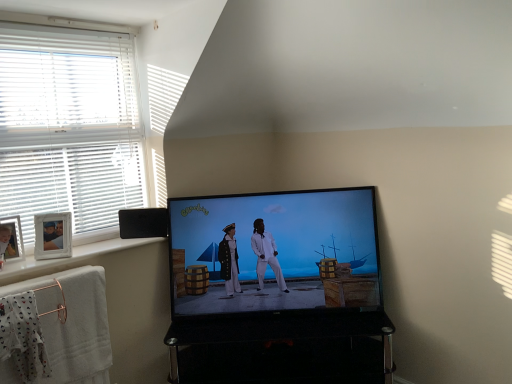
Locate an element on the screen. The height and width of the screenshot is (384, 512). white cotton cloth at lower left is located at coordinates (23, 336).

I want to click on shiny black screen at center, so click(x=274, y=252).

The image size is (512, 384). Describe the element at coordinates (14, 239) in the screenshot. I see `wooden photo frame at left` at that location.

Identify the location of white cotton cloth at lower left. (23, 336).

Which object is closer to the camera taking this photo, white cotton bath towel at lower left or shiny black screen at center?

white cotton bath towel at lower left.

Measure the distance between white cotton bath towel at lower left and shiny black screen at center.

74.74 centimeters.

From a real-world perspective, is white cotton bath towel at lower left beneath shiny black screen at center?

Indeed, from a real-world perspective, white cotton bath towel at lower left is positioned beneath shiny black screen at center.

Is white cotton bath towel at lower left not near shiny black screen at center?

Actually, white cotton bath towel at lower left and shiny black screen at center are a little close together.

Identify the location of laundry on the right side of wooden photo frame at left. This screenshot has width=512, height=384. (23, 336).

Would you say wooden photo frame at left contains white cotton cloth at lower left?

That's incorrect, white cotton cloth at lower left is not inside wooden photo frame at left.

Is wooden photo frame at left wider or thinner than white cotton cloth at lower left?

Clearly, wooden photo frame at left has less width compared to white cotton cloth at lower left.

Based on their positions, is white blinds at left located to the left or right of white cotton cloth at lower left?

Clearly, white blinds at left is on the right of white cotton cloth at lower left in the image.

In the scene shown: Is white blinds at left shorter than white cotton cloth at lower left?

No, white blinds at left is not shorter than white cotton cloth at lower left.

Is white blinds at left positioned in front of white cotton cloth at lower left?

That is False.

Is white cotton cloth at lower left at the back of white blinds at left?

No, white cotton cloth at lower left is not at the back of white blinds at left.

Considering the points (27, 334) and (278, 198), which point is behind, point (27, 334) or point (278, 198)?

The point (278, 198) is farther.

From a real-world perspective, which is physically below, white cotton cloth at lower left or shiny black screen at center?

white cotton cloth at lower left is physically lower.

Who is shorter, white cotton cloth at lower left or shiny black screen at center?

white cotton cloth at lower left.

I want to click on laundry located in front of the shiny black screen at center, so click(23, 336).

Do you think white painted wood at lower left is within shiny black screen at center, or outside of it?

white painted wood at lower left is spatially situated outside shiny black screen at center.

Relative to shiny black screen at center, is white painted wood at lower left in front or behind?

Visually, white painted wood at lower left is located in front of shiny black screen at center.

Would you say white painted wood at lower left is a long distance from shiny black screen at center?

No.

Considering the positions of objects white painted wood at lower left and shiny black screen at center in the image provided, who is more to the left, white painted wood at lower left or shiny black screen at center?

Positioned to the left is white painted wood at lower left.

Is white cotton cloth at lower left taller than wooden photo frame at left?

Yes, white cotton cloth at lower left is taller than wooden photo frame at left.

Does white cotton cloth at lower left have a lesser width compared to wooden photo frame at left?

No.

Where is `picture frame behind the white cotton cloth at lower left`? The width and height of the screenshot is (512, 384). picture frame behind the white cotton cloth at lower left is located at coordinates (14, 239).

Can we say white cotton cloth at lower left lies outside wooden photo frame at left?

white cotton cloth at lower left lies outside wooden photo frame at left's area.

Looking at this image, considering the sizes of objects black glossy tv stand at lower center and white painted wood at lower left in the image provided, who is wider, black glossy tv stand at lower center or white painted wood at lower left?

black glossy tv stand at lower center.

In the image, there is a white painted wood at lower left. Where is `furniture below it (from a real-world perspective)`? This screenshot has height=384, width=512. furniture below it (from a real-world perspective) is located at coordinates (283, 348).

Is black glossy tv stand at lower center turned away from white painted wood at lower left?

No, black glossy tv stand at lower center is not facing away from white painted wood at lower left.

Identify the location of television on the right side of white cotton bath towel at lower left. (274, 252).

The width and height of the screenshot is (512, 384). I want to click on laundry below the wooden photo frame at left (from the image's perspective), so click(23, 336).

From the picture: When comparing their distances from white cotton bath towel at lower left, does white cotton cloth at lower left or shiny black screen at center seem closer?

Based on the image, white cotton cloth at lower left appears to be nearer to white cotton bath towel at lower left.

Looking at the image, which one is located further to white painted wood at lower left, white cotton bath towel at lower left or white cotton cloth at lower left?

Among the two, white cotton cloth at lower left is located further to white painted wood at lower left.

From the image, which object appears to be farther from shiny black screen at center, white cotton cloth at lower left or white painted wood at lower left?

Based on the image, white cotton cloth at lower left appears to be further to shiny black screen at center.

Based on their spatial positions, is white cotton cloth at lower left or white cotton bath towel at lower left further from white painted wood at lower left?

The object further to white painted wood at lower left is white cotton cloth at lower left.

Which object lies nearer to the anchor point wooden photo frame at left, white cotton cloth at lower left or shiny black screen at center?

white cotton cloth at lower left lies closer to wooden photo frame at left than the other object.

Estimate the real-world distances between objects in this image. Which object is closer to white blinds at left, white cotton cloth at lower left or white painted wood at lower left?

white painted wood at lower left is closer to white blinds at left.

Considering their positions, is shiny black screen at center positioned closer to black glossy tv stand at lower center than wooden photo frame at left?

Based on the image, shiny black screen at center appears to be nearer to black glossy tv stand at lower center.

Which object lies nearer to the anchor point white cotton bath towel at lower left, white painted wood at lower left or white blinds at left?

white painted wood at lower left is positioned closer to the anchor white cotton bath towel at lower left.

Where is `window sill between white cotton bath towel at lower left and black glossy tv stand at lower center from left to right`? This screenshot has height=384, width=512. window sill between white cotton bath towel at lower left and black glossy tv stand at lower center from left to right is located at coordinates (68, 259).

Locate an element on the screen. Image resolution: width=512 pixels, height=384 pixels. bath towel between wooden photo frame at left and shiny black screen at center from left to right is located at coordinates (56, 329).

This screenshot has width=512, height=384. Identify the location of television between white blinds at left and black glossy tv stand at lower center in the horizontal direction. (274, 252).

Find the location of a particular element. bath towel between wooden photo frame at left and black glossy tv stand at lower center in the horizontal direction is located at coordinates (56, 329).